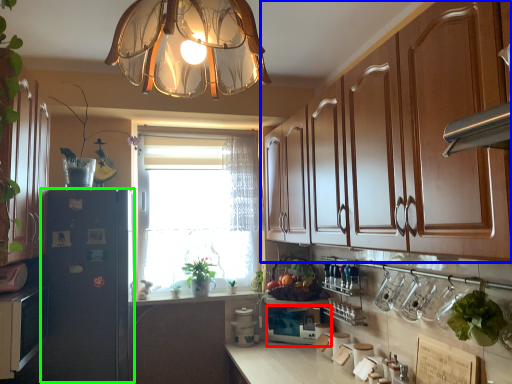
Question: Considering the real-world distances, which object is closest to appliance (highlighted by a red box)? cabinetry (highlighted by a blue box) or fridge (highlighted by a green box).

Choices:
 (A) cabinetry
 (B) fridge

Answer: (A)